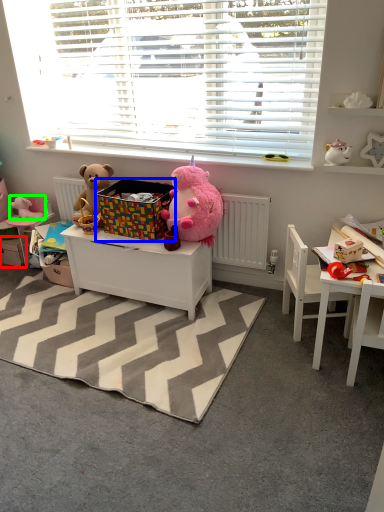
Question: Which object is positioned farthest from drawer (highlighted by a red box)? Select from crate (highlighted by a blue box) and toy (highlighted by a green box).

Choices:
 (A) crate
 (B) toy

Answer: (A)